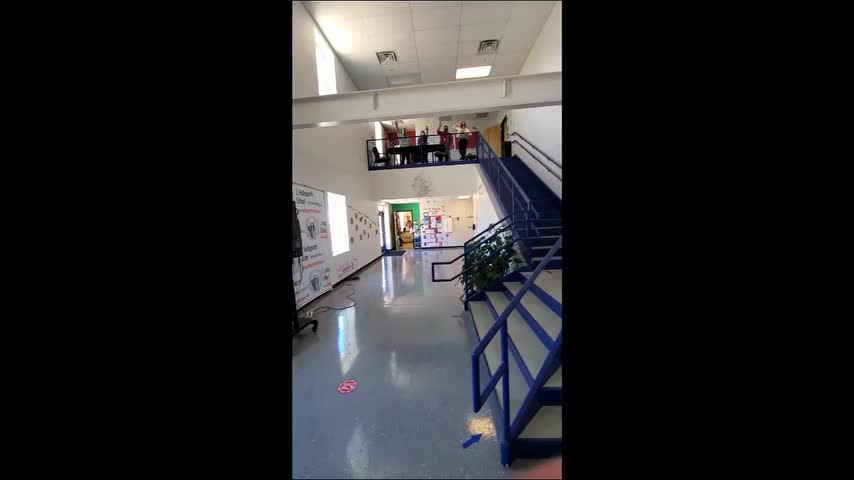
The image size is (854, 480). I want to click on light blue colored floor, tile or linoleum, so click(x=422, y=433), click(x=413, y=412).